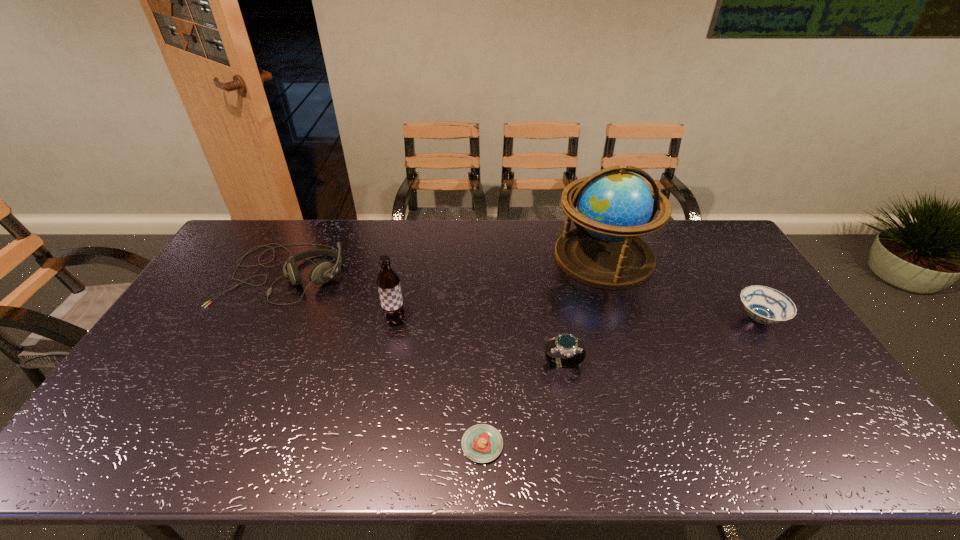
Where is `object present at the far left corner`? This screenshot has height=540, width=960. object present at the far left corner is located at coordinates (322, 272).

Locate an element on the screen. vacant space at the far edge of the desktop is located at coordinates (369, 254).

Identify the location of vacant area at the near edge of the desktop. (384, 447).

In the image, there is a desktop. Where is `free space at the left edge`? The width and height of the screenshot is (960, 540). free space at the left edge is located at coordinates (150, 394).

Image resolution: width=960 pixels, height=540 pixels. In the image, there is a desktop. Identify the location of vacant space at the right edge. (778, 378).

I want to click on vacant region at the far left corner of the desktop, so click(276, 234).

Where is `free space between the leftmost object and the root beer`? free space between the leftmost object and the root beer is located at coordinates (340, 296).

Identify the location of vacant space that's between the shortest object and the fifth farthest object. Image resolution: width=960 pixels, height=540 pixels. (523, 404).

Where is `empty space that is in between the pastry and the tallest object`? empty space that is in between the pastry and the tallest object is located at coordinates (542, 351).

The image size is (960, 540). Identify the location of free space between the rightmost object and the pastry. (620, 381).